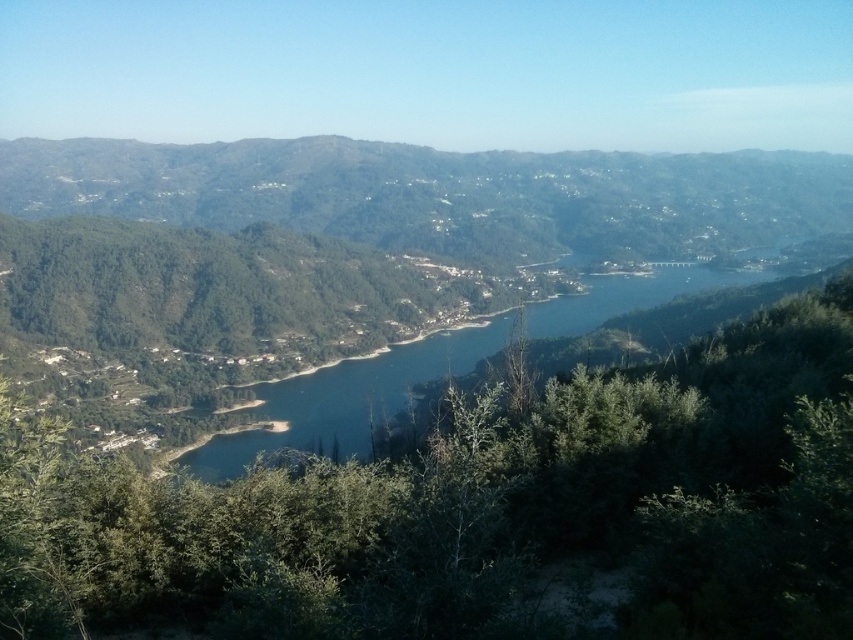
Does green leafy mountain at left have a larger size compared to blue water at center?

Yes.

Is green leafy mountain at left above blue water at center?

Yes, green leafy mountain at left is above blue water at center.

Locate an element on the screen. green leafy mountain at left is located at coordinates (442, 195).

Does green leafy tree at center have a lesser height compared to blue water at center?

Yes.

Who is shorter, green leafy tree at center or blue water at center?

green leafy tree at center is shorter.

Image resolution: width=853 pixels, height=640 pixels. I want to click on green leafy tree at center, so click(480, 506).

Does green leafy tree at center lie in front of green leafy mountain at left?

Yes, green leafy tree at center is closer to the viewer.

Is point (581, 600) positioned after point (595, 221)?

No, (581, 600) is closer to viewer.

I want to click on green leafy tree at center, so click(x=480, y=506).